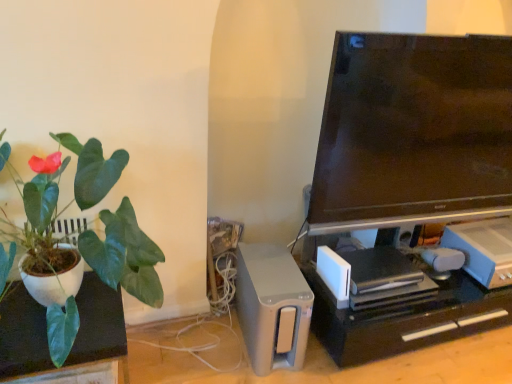
Question: Is white plastic game console at lower right, the 1th appliance positioned from the right, in front of or behind black plastic computer desk at lower right in the image?

Choices:
 (A) front
 (B) behind

Answer: (B)

Question: Is white plastic game console at lower right, the 1th appliance positioned from the right, bigger or smaller than black plastic computer desk at lower right?

Choices:
 (A) small
 (B) big

Answer: (A)

Question: Estimate the real-world distances between objects in this image. Which object is farther from the black plastic computer desk at lower right?

Choices:
 (A) satin silver speaker at lower center, the second appliance in the right-to-left sequence
 (B) matte white pot at left
 (C) white matte plant pot at left
 (D) matte black tv at upper right
 (E) white plastic game console at lower right, which is the second appliance in left-to-right order

Answer: (C)

Question: Estimate the real-world distances between objects in this image. Which object is farther from the satin silver speaker at lower center, the second appliance in the right-to-left sequence?

Choices:
 (A) white matte plant pot at left
 (B) black plastic computer desk at lower right
 (C) matte black tv at upper right
 (D) white plastic game console at lower right, which is the second appliance in left-to-right order
 (E) matte white pot at left

Answer: (D)